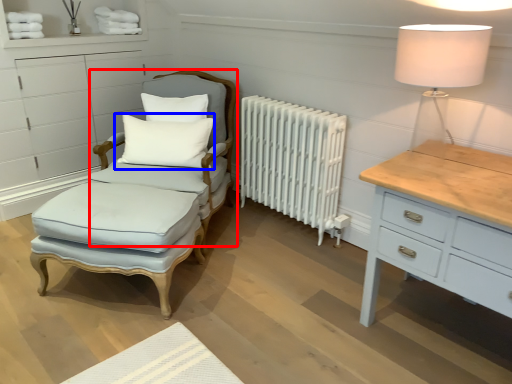
Question: Which point is further to the camera, swivel chair (highlighted by a red box) or pillow (highlighted by a blue box)?

Choices:
 (A) swivel chair
 (B) pillow

Answer: (B)